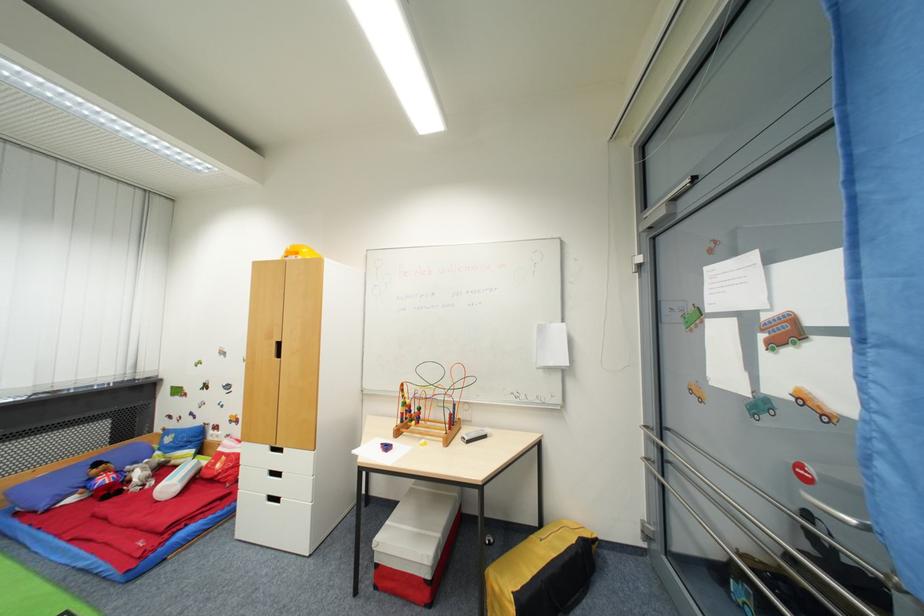
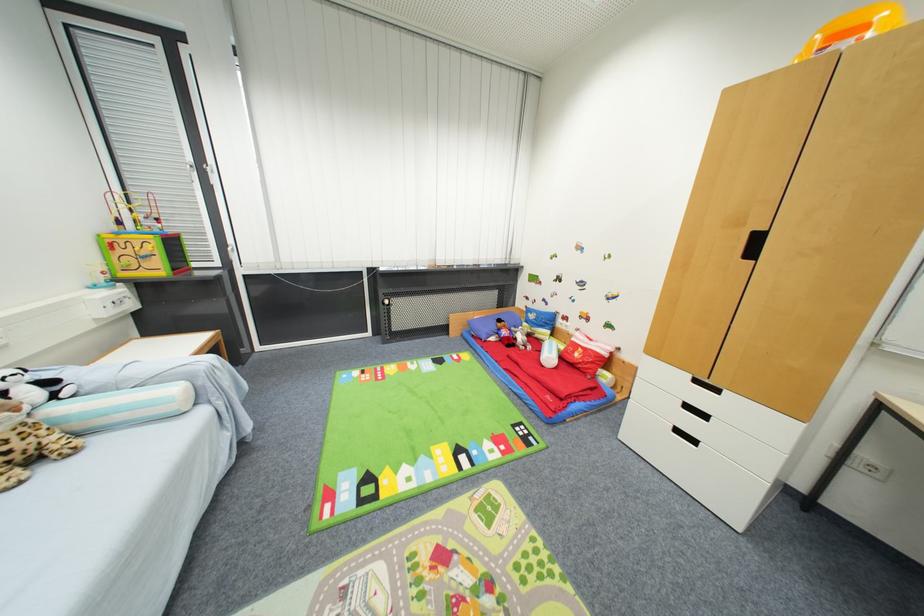
Where in the second image is the point corresponding to (273,448) from the first image?

(695, 378)